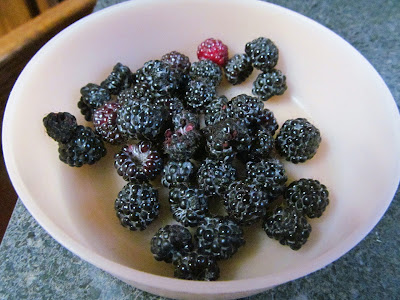
Locate an element on the screen. This screenshot has height=300, width=400. wooden cabinet is located at coordinates (15, 19).